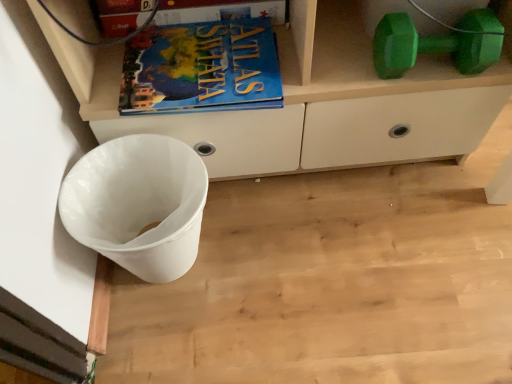
Question: Is blue matte atlas book at upper center in front of or behind green rubber dumbbell at upper right in the image?

Choices:
 (A) front
 (B) behind

Answer: (B)

Question: Is blue matte atlas book at upper center spatially inside green rubber dumbbell at upper right, or outside of it?

Choices:
 (A) outside
 (B) inside

Answer: (A)

Question: Estimate the real-world distances between objects in this image. Which object is farther from the white plastic waste bin at lower left?

Choices:
 (A) blue matte book at upper center
 (B) white matte cabinet at lower left
 (C) green rubber dumbbell at upper right
 (D) blue matte atlas book at upper center

Answer: (C)

Question: Based on their relative distances, which object is farther from the blue matte book at upper center?

Choices:
 (A) white plastic waste bin at lower left
 (B) green rubber dumbbell at upper right
 (C) blue matte atlas book at upper center
 (D) white matte cabinet at lower left

Answer: (A)